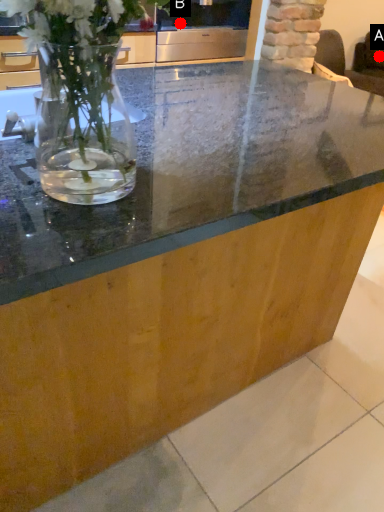
Question: Two points are circled on the image, labeled by A and B beside each circle. Which point appears closest to the camera in this image?

Choices:
 (A) A is closer
 (B) B is closer

Answer: (B)